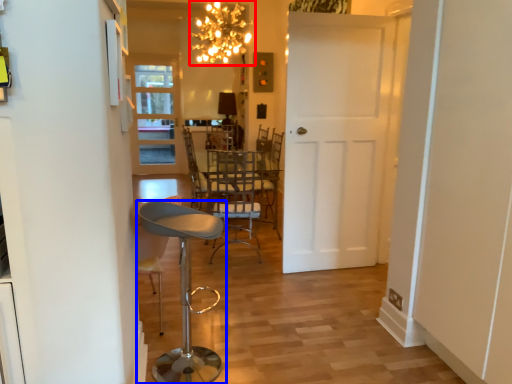
Question: Among these objects, which one is nearest to the camera, lamp (highlighted by a red box) or stool (highlighted by a blue box)?

Choices:
 (A) lamp
 (B) stool

Answer: (B)